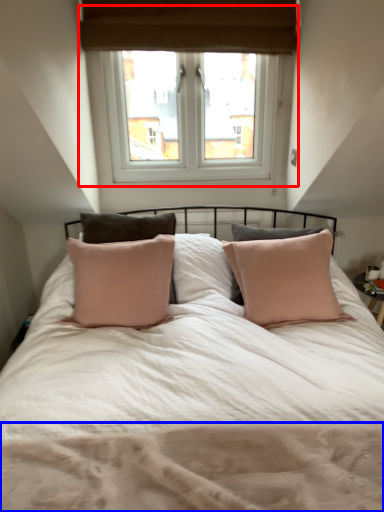
Question: Which point is further to the camera, window (highlighted by a red box) or mattress (highlighted by a blue box)?

Choices:
 (A) window
 (B) mattress

Answer: (A)